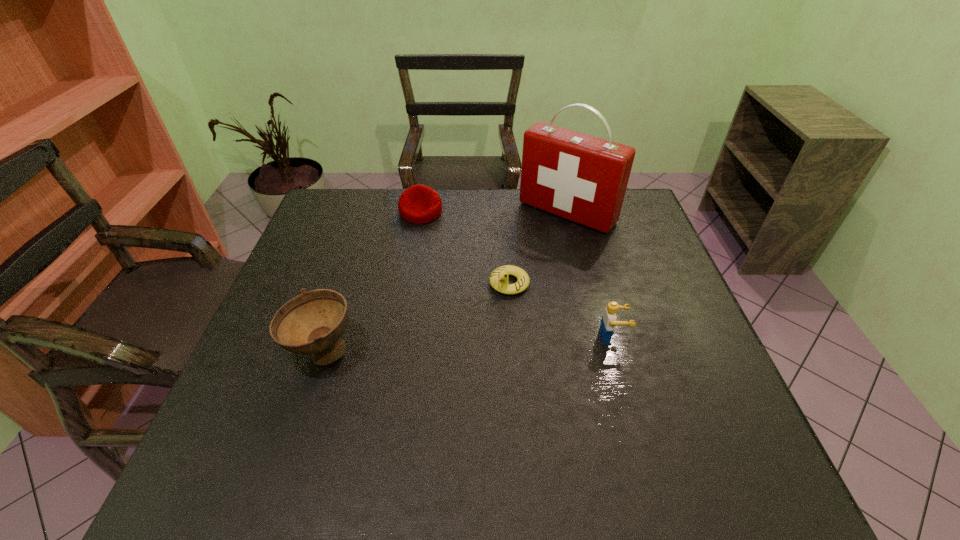
Locate which object ranks fourth in proximity to the third tallest object. Please provide its 2D coordinates. Your answer should be formatted as a tuple, i.e. [(x, y)], where the tuple contains the x and y coordinates of a point satisfying the conditions above.

[(418, 204)]

Locate an element on the screen. The width and height of the screenshot is (960, 540). free spot that satisfies the following two spatial constraints: 1. on the back side of the second tallest object; 2. on the face of the third shortest object is located at coordinates 328,337.

Find the location of a particular element. The width and height of the screenshot is (960, 540). vacant region that satisfies the following two spatial constraints: 1. on the back side of the duckling; 2. on the right side of the soup bowl is located at coordinates (346, 283).